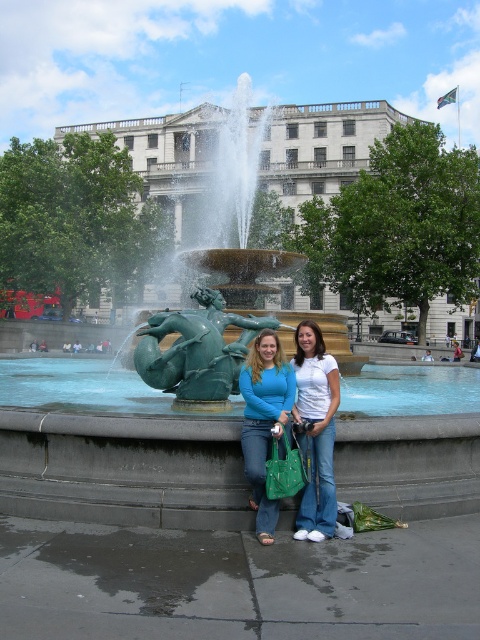
Can you confirm if green patinated bronze mermaid at center is bigger than matte blue shirt at center?

Indeed, green patinated bronze mermaid at center has a larger size compared to matte blue shirt at center.

Identify the location of green patinated bronze mermaid at center. (196, 349).

Identify the location of green patinated bronze mermaid at center. click(196, 349).

Does white cotton shirt at center have a larger size compared to matte blue shirt at center?

No.

What do you see at coordinates (315, 429) in the screenshot? I see `white cotton shirt at center` at bounding box center [315, 429].

Describe the element at coordinates (315, 429) in the screenshot. I see `white cotton shirt at center` at that location.

Image resolution: width=480 pixels, height=640 pixels. Find the location of `white cotton shirt at center`. white cotton shirt at center is located at coordinates (315, 429).

Who is more forward, (168,317) or (332,499)?

Positioned in front is point (332,499).

This screenshot has width=480, height=640. What do you see at coordinates (196, 349) in the screenshot? I see `green patinated bronze mermaid at center` at bounding box center [196, 349].

Locate an element on the screen. The image size is (480, 640). green patinated bronze mermaid at center is located at coordinates (196, 349).